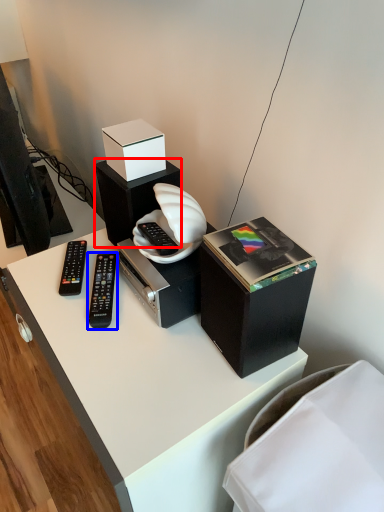
Question: Which object appears closest to the camera in this image, speaker (highlighted by a red box) or remote control (highlighted by a blue box)?

Choices:
 (A) speaker
 (B) remote control

Answer: (B)